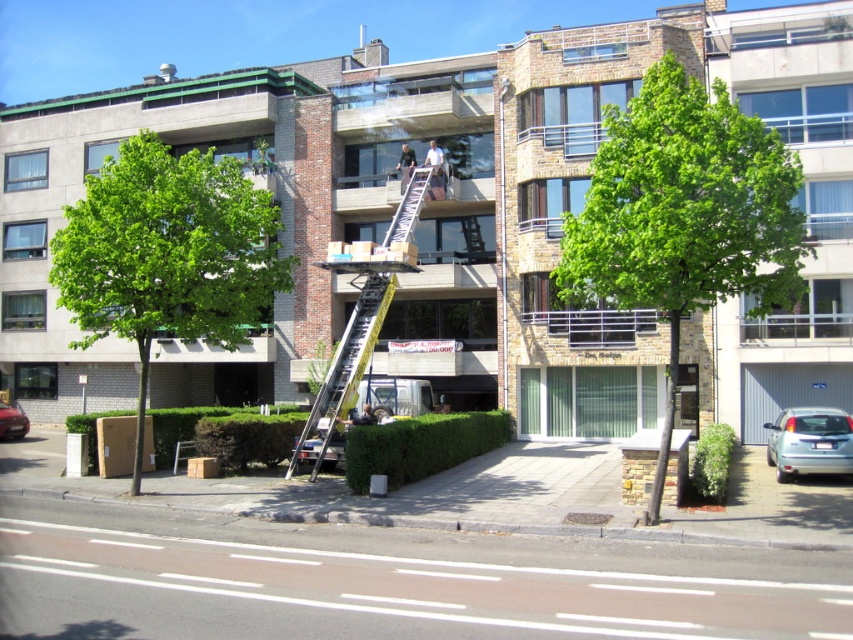
Can you confirm if green leafy tree at center is wider than shiny red car at lower left?

Yes, green leafy tree at center is wider than shiny red car at lower left.

Is green leafy tree at center to the right of shiny red car at lower left from the viewer's perspective?

Yes, green leafy tree at center is to the right of shiny red car at lower left.

Is point (772, 173) more distant than point (16, 424)?

No.

The image size is (853, 640). Find the location of `green leafy tree at center`. green leafy tree at center is located at coordinates (683, 216).

Between green leafy tree at center and yellow metallic ladder at center, which one has more height?

Standing taller between the two is green leafy tree at center.

Is point (666, 292) closer to viewer compared to point (337, 381)?

Yes, point (666, 292) is in front of point (337, 381).

Is point (659, 225) more distant than point (363, 314)?

That is False.

Where is `green leafy tree at center`? green leafy tree at center is located at coordinates [x=683, y=216].

Is the position of silver metallic ladder at center more distant than that of shiny red car at lower left?

No, silver metallic ladder at center is closer to the viewer.

Can you confirm if silver metallic ladder at center is positioned above shiny red car at lower left?

Yes.

Measure the distance between silver metallic ladder at center and camera.

They are 17.84 meters apart.

Identify the location of silver metallic ladder at center. (361, 316).